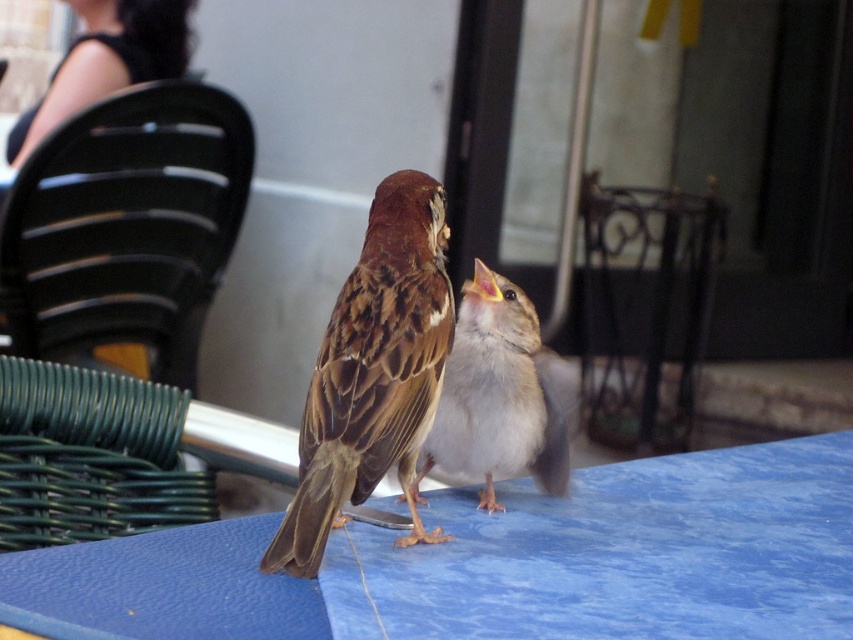
Does point (33, 252) come in front of point (624, 240)?

Yes, point (33, 252) is in front of point (624, 240).

You are a GUI agent. You are given a task and a screenshot of the screen. Output one action in this format:
    pyautogui.click(x=<x>, y=<y>)
    Task: Click on the black plastic chair at upper left
    Image resolution: width=853 pixels, height=640 pixels.
    Given the screenshot: What is the action you would take?
    pyautogui.click(x=126, y=225)

Who is taller, black plastic chair at upper left or brown speckled feathers at center?

With more height is black plastic chair at upper left.

Is black plastic chair at upper left wider than brown speckled feathers at center?

Yes.

Locate an element on the screen. This screenshot has height=640, width=853. black plastic chair at upper left is located at coordinates (126, 225).

Where is `black plastic chair at upper left`? The height and width of the screenshot is (640, 853). black plastic chair at upper left is located at coordinates (126, 225).

Which is behind, point (675, 202) or point (486, 314)?

The point (675, 202) is more distant.

Does point (614, 209) come in front of point (444, 385)?

No, (614, 209) is behind (444, 385).

Which is in front, point (694, 292) or point (471, 401)?

Point (471, 401) is more forward.

What are the coordinates of `iron-forged chair at center` in the screenshot? It's located at (641, 301).